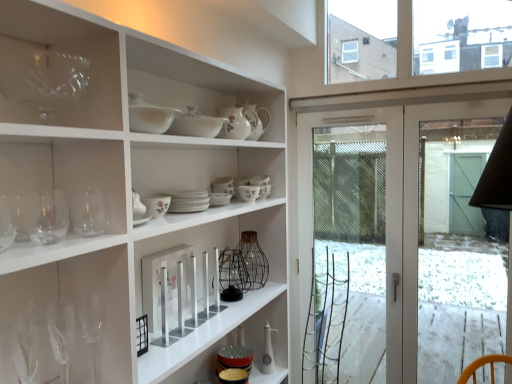
Question: Is white ceramic bowl at upper center, placed as the 6th tableware when sorted from back to front, at the right side of matte white ceramic oil bottle at center, which is counted as the first tableware, starting from the bottom?

Choices:
 (A) no
 (B) yes

Answer: (A)

Question: Does white ceramic bowl at upper center, the 6th tableware positioned from the bottom, have a lesser height compared to matte white ceramic oil bottle at center, which is the first tableware from back to front?

Choices:
 (A) yes
 (B) no

Answer: (A)

Question: Is white ceramic bowl at upper center, placed as the 6th tableware when sorted from back to front, closer to camera compared to matte white ceramic oil bottle at center, acting as the seventh tableware starting from the top?

Choices:
 (A) yes
 (B) no

Answer: (A)

Question: From the image's perspective, would you say white ceramic bowl at upper center, placed as the 6th tableware when sorted from back to front, is shown under matte white ceramic oil bottle at center, which is the first tableware from back to front?

Choices:
 (A) no
 (B) yes

Answer: (A)

Question: From the image's perspective, is white ceramic bowl at upper center, placed as the 6th tableware when sorted from back to front, over matte white ceramic oil bottle at center, which ranks as the 7th tableware in front-to-back order?

Choices:
 (A) yes
 (B) no

Answer: (A)

Question: From a real-world perspective, is white ceramic bowl at upper center, the 6th tableware positioned from the bottom, positioned under matte white ceramic oil bottle at center, acting as the seventh tableware starting from the top, based on gravity?

Choices:
 (A) no
 (B) yes

Answer: (A)

Question: Can transparent glass screen door at right be found inside transparent glass wine glass at lower left, the 5th wine glass positioned from the front?

Choices:
 (A) yes
 (B) no

Answer: (B)

Question: Considering the relative sizes of transparent glass wine glass at lower left, the 1th wine glass positioned from the back, and transparent glass screen door at right in the image provided, is transparent glass wine glass at lower left, the 1th wine glass positioned from the back, wider than transparent glass screen door at right?

Choices:
 (A) yes
 (B) no

Answer: (B)

Question: Can you confirm if transparent glass wine glass at lower left, the 5th wine glass positioned from the front, is taller than transparent glass screen door at right?

Choices:
 (A) yes
 (B) no

Answer: (B)

Question: From the image's perspective, is transparent glass wine glass at lower left, the 5th wine glass positioned from the front, located beneath transparent glass screen door at right?

Choices:
 (A) yes
 (B) no

Answer: (A)

Question: Is transparent glass wine glass at lower left, the 5th wine glass positioned from the front, at the left side of transparent glass screen door at right?

Choices:
 (A) no
 (B) yes

Answer: (B)

Question: Can we say transparent glass wine glass at lower left, the 5th wine glass positioned from the front, lies outside transparent glass screen door at right?

Choices:
 (A) yes
 (B) no

Answer: (A)

Question: Is white ceramic bowl at upper center, which is the second tableware in front-to-back order, positioned beyond the bounds of transparent glass at upper left?

Choices:
 (A) yes
 (B) no

Answer: (A)